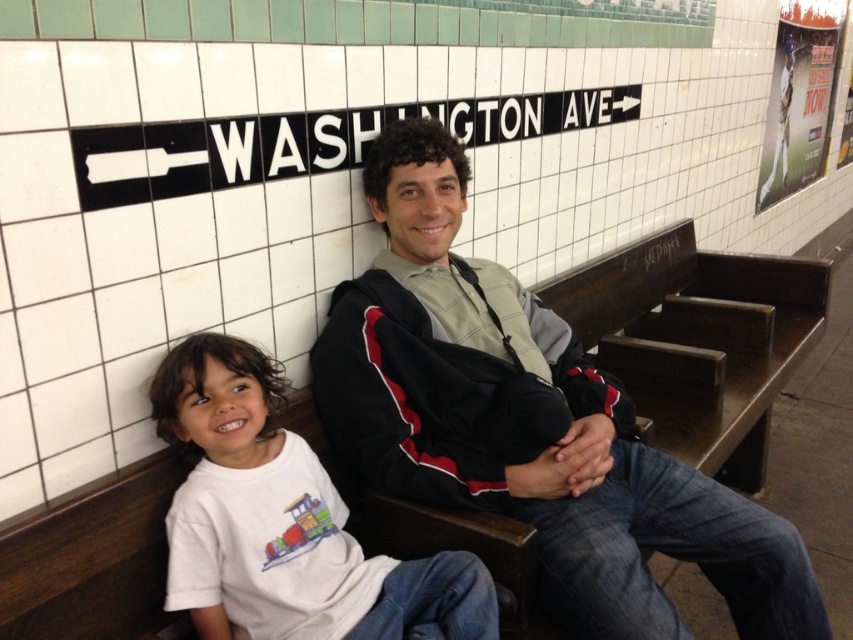
Who is positioned more to the right, dark gray jacket at center or white cotton shirt at lower left?

From the viewer's perspective, dark gray jacket at center appears more on the right side.

Is dark gray jacket at center taller than white cotton shirt at lower left?

Yes.

Is point (537, 316) in front of point (283, 384)?

That is False.

This screenshot has height=640, width=853. Identify the location of dark gray jacket at center. (527, 422).